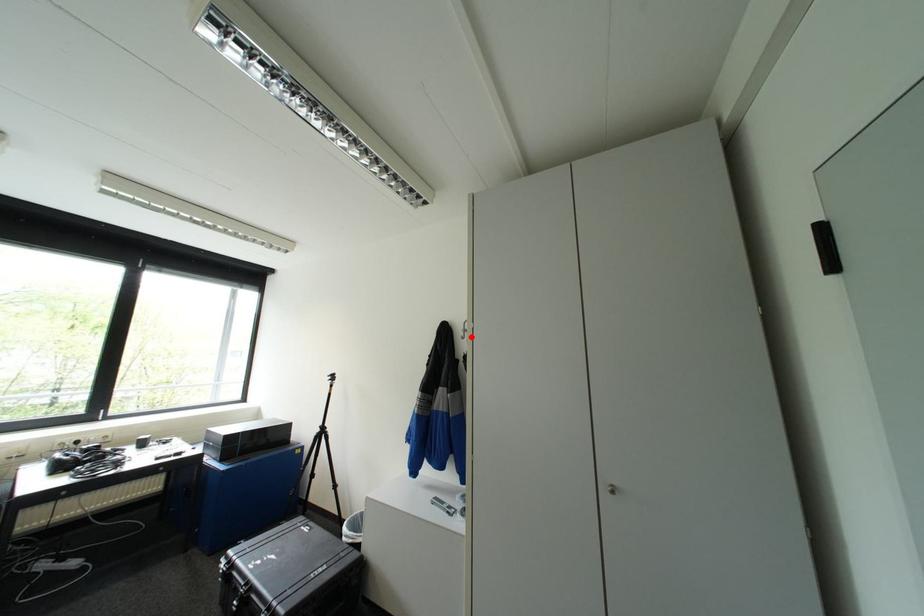
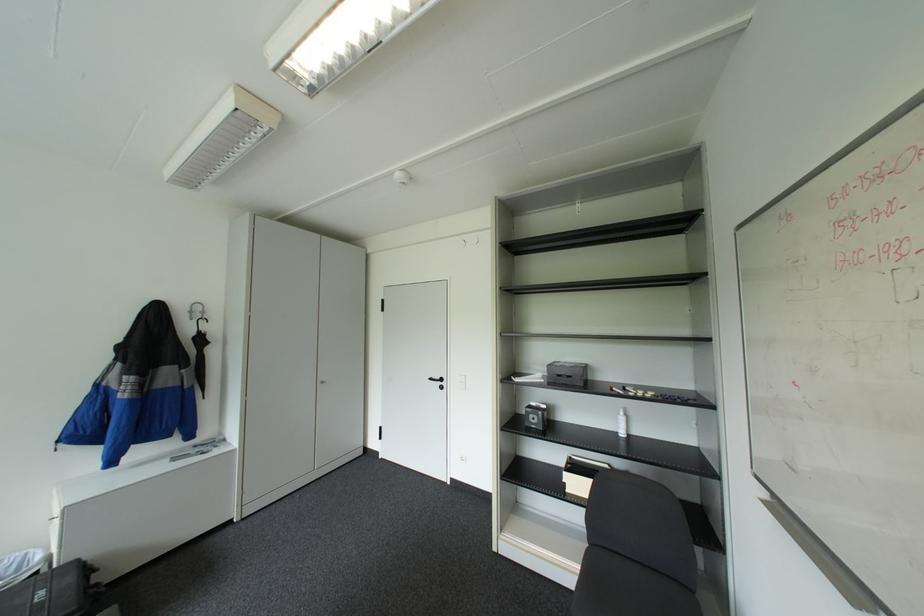
Find the pixel in the second image that matches the highlighted location in the first image.

(200, 318)